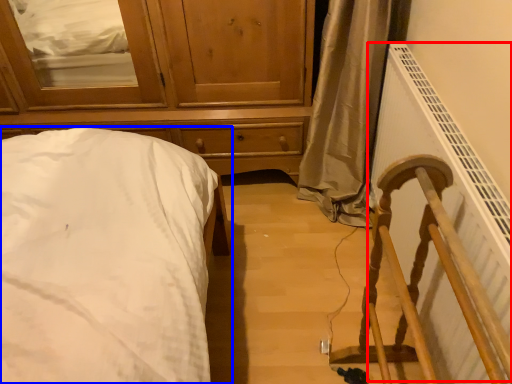
Question: Which object appears closest to the camera in this image, radiator (highlighted by a red box) or bed (highlighted by a blue box)?

Choices:
 (A) radiator
 (B) bed

Answer: (A)